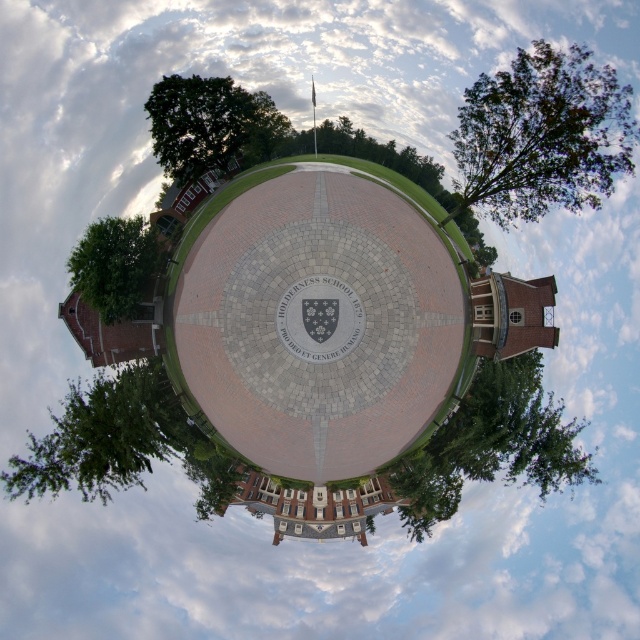
Is green leafy tree at lower right in front of gray stone clock at center?

No, it is not.

Who is positioned more to the right, green leafy tree at lower right or gray stone clock at center?

green leafy tree at lower right is more to the right.

This screenshot has width=640, height=640. Find the location of `green leafy tree at lower right`. green leafy tree at lower right is located at coordinates (492, 444).

Where is `green leafy tree at lower right`? green leafy tree at lower right is located at coordinates (492, 444).

Is green leafy tree at upper left taller than gray stone clock at center?

Yes.

Consider the image. Which is more to the right, green leafy tree at upper left or gray stone clock at center?

gray stone clock at center

Where is `green leafy tree at upper left`? The image size is (640, 640). green leafy tree at upper left is located at coordinates (209, 124).

Which of these two, green leafy tree at upper right or green leafy tree at upper left, stands shorter?

Standing shorter between the two is green leafy tree at upper left.

Does green leafy tree at upper right appear under green leafy tree at upper left?

Yes.

This screenshot has width=640, height=640. Describe the element at coordinates (541, 134) in the screenshot. I see `green leafy tree at upper right` at that location.

Locate an element on the screen. green leafy tree at upper right is located at coordinates (541, 134).